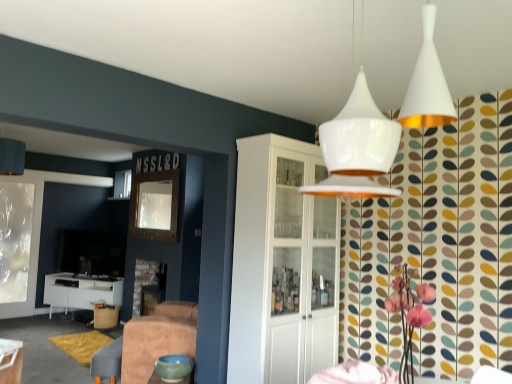
Question: Is leather swivel chair at lower center directly adjacent to burlap stool at lower left?

Choices:
 (A) no
 (B) yes

Answer: (A)

Question: From the image's perspective, is leather swivel chair at lower center below burlap stool at lower left?

Choices:
 (A) no
 (B) yes

Answer: (A)

Question: Can you confirm if leather swivel chair at lower center is thinner than burlap stool at lower left?

Choices:
 (A) no
 (B) yes

Answer: (B)

Question: Is leather swivel chair at lower center located outside burlap stool at lower left?

Choices:
 (A) no
 (B) yes

Answer: (B)

Question: Can you confirm if leather swivel chair at lower center is bigger than burlap stool at lower left?

Choices:
 (A) yes
 (B) no

Answer: (A)

Question: Looking at their shapes, would you say white glossy table at lower left, the 1th table viewed from the right, is wider or thinner than white glossy table at lower left, which is the first table from left to right?

Choices:
 (A) wide
 (B) thin

Answer: (B)

Question: Considering the positions of point (2, 372) and point (78, 289), is point (2, 372) closer or farther from the camera than point (78, 289)?

Choices:
 (A) farther
 (B) closer

Answer: (B)

Question: From their relative heights in the image, would you say white glossy table at lower left, the 1th table viewed from the right, is taller or shorter than white glossy table at lower left, which ranks as the 2th table in front-to-back order?

Choices:
 (A) tall
 (B) short

Answer: (B)

Question: From the image's perspective, is white glossy table at lower left, the 2th table viewed from the left, above or below white glossy table at lower left, which appears as the second table when viewed from the top?

Choices:
 (A) below
 (B) above

Answer: (B)

Question: In terms of width, does burlap stool at lower left look wider or thinner when compared to leather swivel chair at lower center?

Choices:
 (A) thin
 (B) wide

Answer: (B)

Question: Based on their sizes in the image, would you say burlap stool at lower left is bigger or smaller than leather swivel chair at lower center?

Choices:
 (A) big
 (B) small

Answer: (B)

Question: In terms of height, does burlap stool at lower left look taller or shorter compared to leather swivel chair at lower center?

Choices:
 (A) short
 (B) tall

Answer: (B)

Question: Is burlap stool at lower left inside or outside of leather swivel chair at lower center?

Choices:
 (A) inside
 (B) outside

Answer: (B)

Question: Is point (99, 354) closer or farther from the camera than point (9, 354)?

Choices:
 (A) farther
 (B) closer

Answer: (A)

Question: Do you think leather swivel chair at lower center is within white glossy table at lower left, the 2th table viewed from the left, or outside of it?

Choices:
 (A) inside
 (B) outside

Answer: (B)